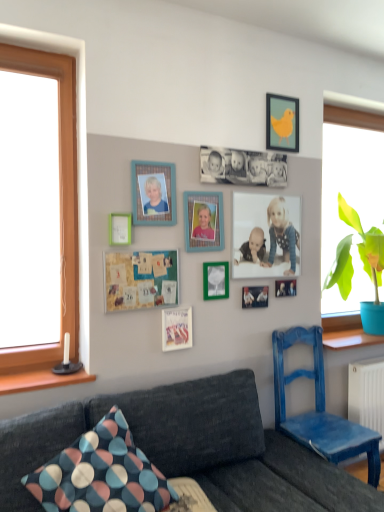
Question: Can you confirm if green matte picture frame at center, which ranks as the 4th picture frame in bottom-to-top order, is shorter than matte plastic picture frame at center, which is counted as the first picture frame, starting from the bottom?

Choices:
 (A) yes
 (B) no

Answer: (A)

Question: Is green matte picture frame at center, which ranks as the 4th picture frame in bottom-to-top order, oriented towards matte plastic picture frame at center, positioned as the tenth picture frame in top-to-bottom order?

Choices:
 (A) yes
 (B) no

Answer: (B)

Question: From a real-world perspective, is green matte picture frame at center, which appears as the seventh picture frame when viewed from the top, over matte plastic picture frame at center, which is counted as the first picture frame, starting from the bottom?

Choices:
 (A) no
 (B) yes

Answer: (B)

Question: From a real-world perspective, is green matte picture frame at center, which ranks as the 4th picture frame in bottom-to-top order, physically below matte plastic picture frame at center, positioned as the tenth picture frame in top-to-bottom order?

Choices:
 (A) yes
 (B) no

Answer: (B)

Question: Is there a large distance between green matte picture frame at center, which appears as the seventh picture frame when viewed from the top, and matte plastic picture frame at center, which is counted as the first picture frame, starting from the bottom?

Choices:
 (A) yes
 (B) no

Answer: (B)

Question: In terms of height, does matte plastic picture frame at center, positioned as the tenth picture frame in top-to-bottom order, look taller or shorter compared to polka dot fabric pillow at lower left?

Choices:
 (A) short
 (B) tall

Answer: (A)

Question: In the image, is matte plastic picture frame at center, positioned as the tenth picture frame in top-to-bottom order, positioned in front of or behind polka dot fabric pillow at lower left?

Choices:
 (A) behind
 (B) front

Answer: (A)

Question: In terms of width, does matte plastic picture frame at center, positioned as the tenth picture frame in top-to-bottom order, look wider or thinner when compared to polka dot fabric pillow at lower left?

Choices:
 (A) thin
 (B) wide

Answer: (A)

Question: From the image's perspective, is matte plastic picture frame at center, which is counted as the first picture frame, starting from the bottom, positioned above or below polka dot fabric pillow at lower left?

Choices:
 (A) below
 (B) above

Answer: (B)

Question: From a real-world perspective, is wooden photo frame at center, the seventh picture frame from the bottom, positioned above or below green leafy plant in blue pot at right?

Choices:
 (A) above
 (B) below

Answer: (A)

Question: Is point (200, 245) positioned closer to the camera than point (347, 234)?

Choices:
 (A) farther
 (B) closer

Answer: (B)

Question: Relative to green leafy plant in blue pot at right, is wooden photo frame at center, positioned as the fourth picture frame in top-to-bottom order, in front or behind?

Choices:
 (A) behind
 (B) front

Answer: (B)

Question: From their relative heights in the image, would you say wooden photo frame at center, positioned as the fourth picture frame in top-to-bottom order, is taller or shorter than green leafy plant in blue pot at right?

Choices:
 (A) tall
 (B) short

Answer: (B)

Question: Is green leafy plant in blue pot at right spatially inside matte black picture frame at center, placed as the second picture frame when sorted from bottom to top, or outside of it?

Choices:
 (A) inside
 (B) outside

Answer: (B)

Question: Looking at their shapes, would you say green leafy plant in blue pot at right is wider or thinner than matte black picture frame at center, the 9th picture frame positioned from the top?

Choices:
 (A) thin
 (B) wide

Answer: (B)